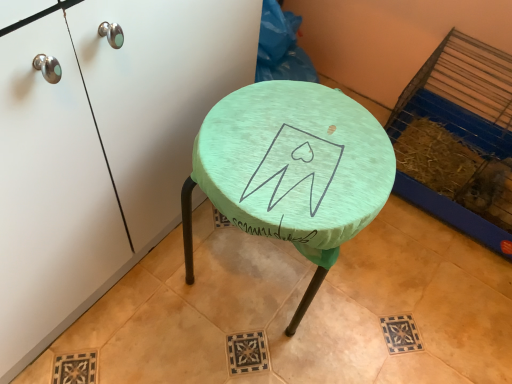
At what (x,y) coordinates should I click in order to perform the action: click on teal fabric stool at center. Please return your answer as a coordinate pair (x, y). Looking at the image, I should click on (x=292, y=170).

From the picture: Measure the distance between teal fabric stool at center and camera.

They are 59.79 centimeters apart.

Measure the distance between point (352, 161) and camera.

Point (352, 161) is 26.69 inches away from camera.

Describe the element at coordinates (292, 170) in the screenshot. This screenshot has height=384, width=512. I see `teal fabric stool at center` at that location.

Identify the location of teal fabric stool at center. (292, 170).